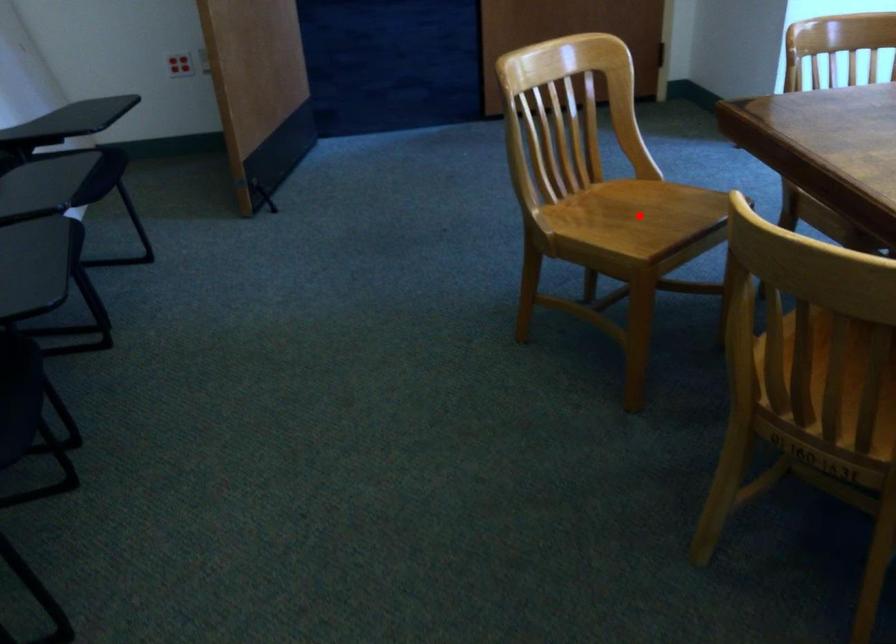
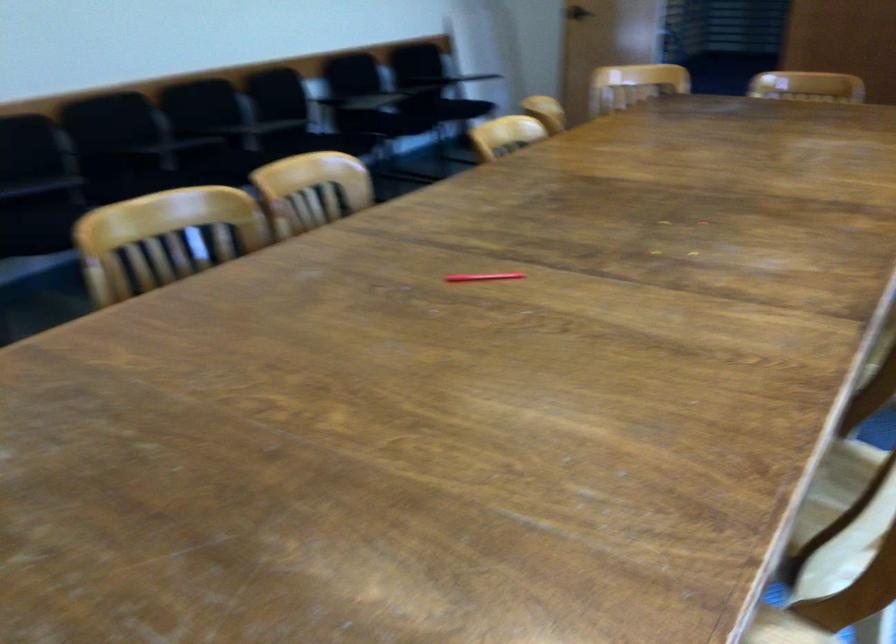
Question: I am providing you with two images of the same scene from different viewpoints. A red point is marked on the first image. At the location where the point appears in image 1, is it still visible in image 2?

Choices:
 (A) Yes
 (B) No

Answer: (B)